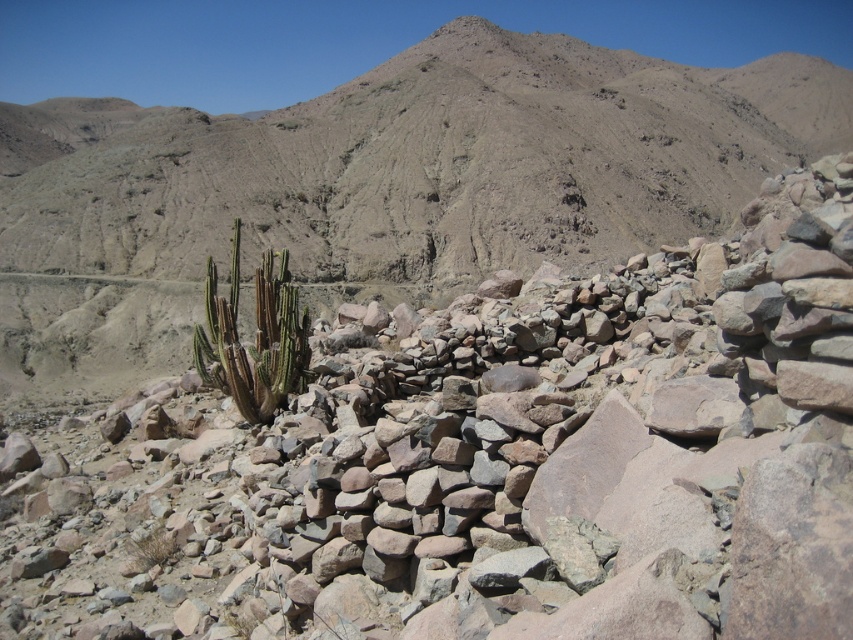
You are a desert explorer who needs to find the tallest cactus in the area. Which one is taller between the green spiny cactus at center and the green spiky cactus at lower left?

The green spiny cactus at center is much taller than the green spiky cactus at lower left, so it is the tallest one.

You are a desert explorer who needs to identify the tallest cactus in the scene. Which one is taller between the green spiny cactus at center and the green spiky cactus at lower left?

The green spiny cactus at center is taller than the green spiky cactus at lower left.